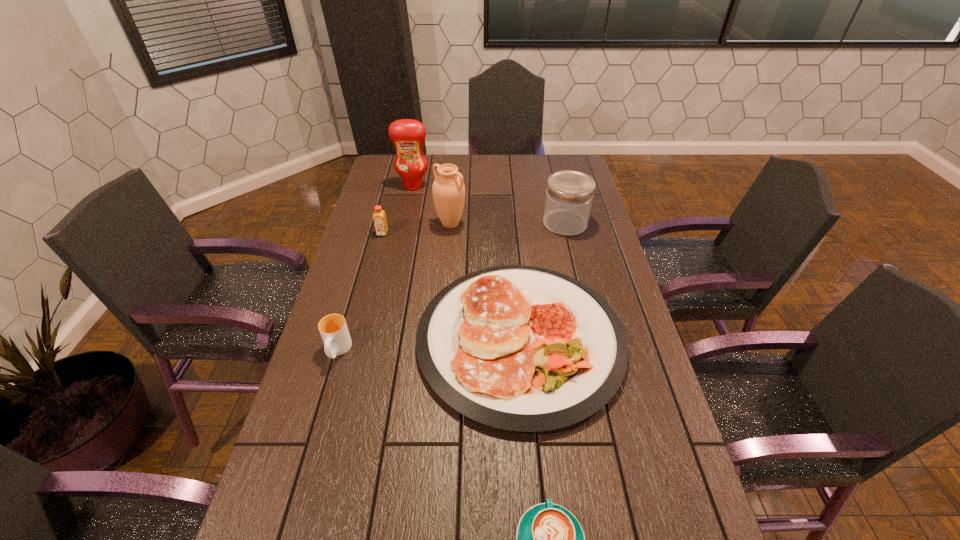
The height and width of the screenshot is (540, 960). I want to click on the farthest object, so click(408, 135).

You are a GUI agent. You are given a task and a screenshot of the screen. Output one action in this format:
    pyautogui.click(x=<x>, y=<y>)
    Task: Click on the condiment
    
    Given the screenshot: What is the action you would take?
    click(x=408, y=135)

This screenshot has height=540, width=960. Find the location of `the sixth shortest object`. the sixth shortest object is located at coordinates (448, 190).

At what (x,y) coordinates should I click in order to perform the action: click on jar. Please return your answer as a coordinate pair (x, y). This screenshot has width=960, height=540. Looking at the image, I should click on (569, 196).

At what (x,y) coordinates should I click in order to perform the action: click on orange juice. Please return your answer as a coordinate pair (x, y). The image size is (960, 540). Looking at the image, I should click on (379, 216).

The width and height of the screenshot is (960, 540). I want to click on cup, so click(x=333, y=328).

Image resolution: width=960 pixels, height=540 pixels. Identify the location of dish. (521, 348).

This screenshot has height=540, width=960. What are the coordinates of `vacant point located 0.240m on the label side of the tallest object` in the screenshot? It's located at (405, 227).

The width and height of the screenshot is (960, 540). In order to click on blank space located on the left of the sixth shortest object in this screenshot , I will do `click(384, 224)`.

Find the location of a particular element. vacant space situated 0.400m on the front of the fifth shortest object is located at coordinates (588, 321).